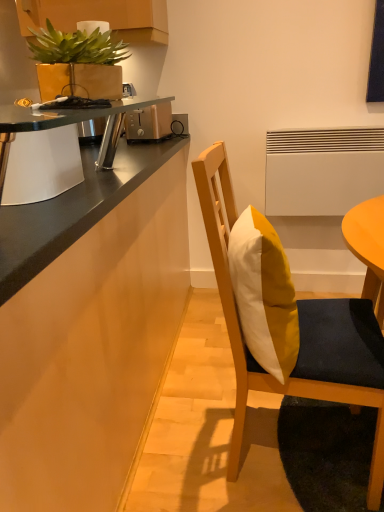
Question: Should I look upward or downward to see metallic silver desk at upper left?

Choices:
 (A) up
 (B) down

Answer: (A)

Question: Is the position of wooden chair with cushion at center more distant than that of matte gold pot at upper left?

Choices:
 (A) yes
 (B) no

Answer: (B)

Question: Could matte gold pot at upper left be considered to be inside wooden chair with cushion at center?

Choices:
 (A) yes
 (B) no

Answer: (B)

Question: Is wooden chair with cushion at center positioned with its back to matte gold pot at upper left?

Choices:
 (A) no
 (B) yes

Answer: (A)

Question: Are wooden chair with cushion at center and matte gold pot at upper left beside each other?

Choices:
 (A) yes
 (B) no

Answer: (B)

Question: From a real-world perspective, is wooden chair with cushion at center over matte gold pot at upper left?

Choices:
 (A) no
 (B) yes

Answer: (A)

Question: Is wooden chair with cushion at center positioned far away from matte gold pot at upper left?

Choices:
 (A) no
 (B) yes

Answer: (A)

Question: Considering the relative sizes of satin gold toaster at upper center and matte gold pot at upper left in the image provided, is satin gold toaster at upper center shorter than matte gold pot at upper left?

Choices:
 (A) yes
 (B) no

Answer: (B)

Question: Can we say satin gold toaster at upper center lies outside matte gold pot at upper left?

Choices:
 (A) no
 (B) yes

Answer: (B)

Question: Can you confirm if satin gold toaster at upper center is positioned to the right of matte gold pot at upper left?

Choices:
 (A) no
 (B) yes

Answer: (B)

Question: Does satin gold toaster at upper center appear on the left side of matte gold pot at upper left?

Choices:
 (A) yes
 (B) no

Answer: (B)

Question: From the image's perspective, would you say satin gold toaster at upper center is positioned over matte gold pot at upper left?

Choices:
 (A) yes
 (B) no

Answer: (A)

Question: Considering the relative positions of satin gold toaster at upper center and matte gold pot at upper left in the image provided, is satin gold toaster at upper center behind matte gold pot at upper left?

Choices:
 (A) no
 (B) yes

Answer: (B)

Question: From a real-world perspective, is metallic silver desk at upper left positioned under yellow matte pillow at center based on gravity?

Choices:
 (A) yes
 (B) no

Answer: (B)